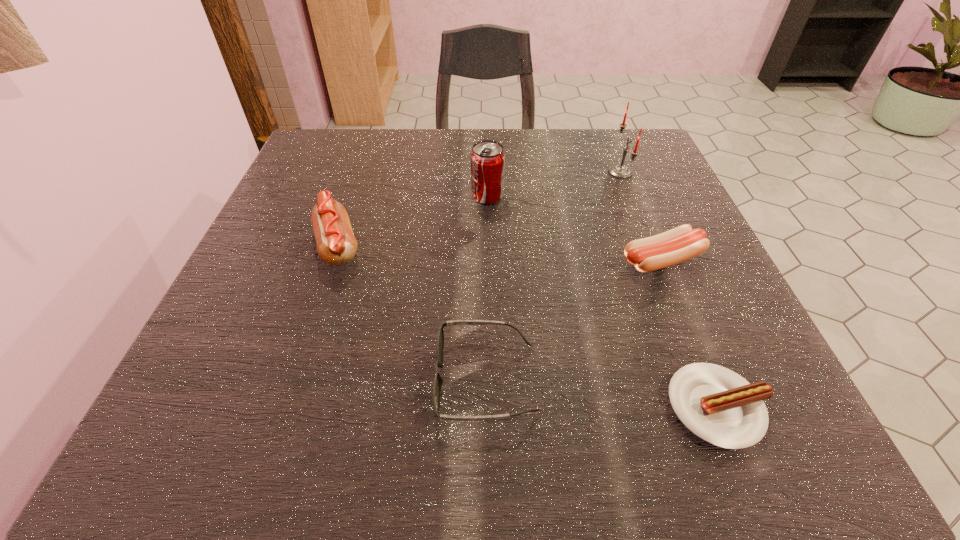
The height and width of the screenshot is (540, 960). Find the location of `the tallest object`. the tallest object is located at coordinates (617, 170).

Locate an element on the screen. the fifth shortest object is located at coordinates (487, 158).

The image size is (960, 540). Identify the location of the leftmost sausage. click(336, 244).

Locate an element on the screen. the leftmost object is located at coordinates (336, 244).

The image size is (960, 540). Find the location of `the second tallest sausage`. the second tallest sausage is located at coordinates (679, 244).

Identify the location of the fifth tallest object. (436, 395).

At what (x,y) coordinates should I click in order to perform the action: click on the shortest sausage. Please return your answer as a coordinate pair (x, y). This screenshot has height=540, width=960. Looking at the image, I should click on (719, 406).

Locate an element on the screen. This screenshot has height=540, width=960. the shortest object is located at coordinates (719, 406).

Where is `free space located 0.170m on the front-facing side of the candle`? free space located 0.170m on the front-facing side of the candle is located at coordinates (532, 172).

Where is `vacant region located on the front-facing side of the candle`? The image size is (960, 540). vacant region located on the front-facing side of the candle is located at coordinates (528, 172).